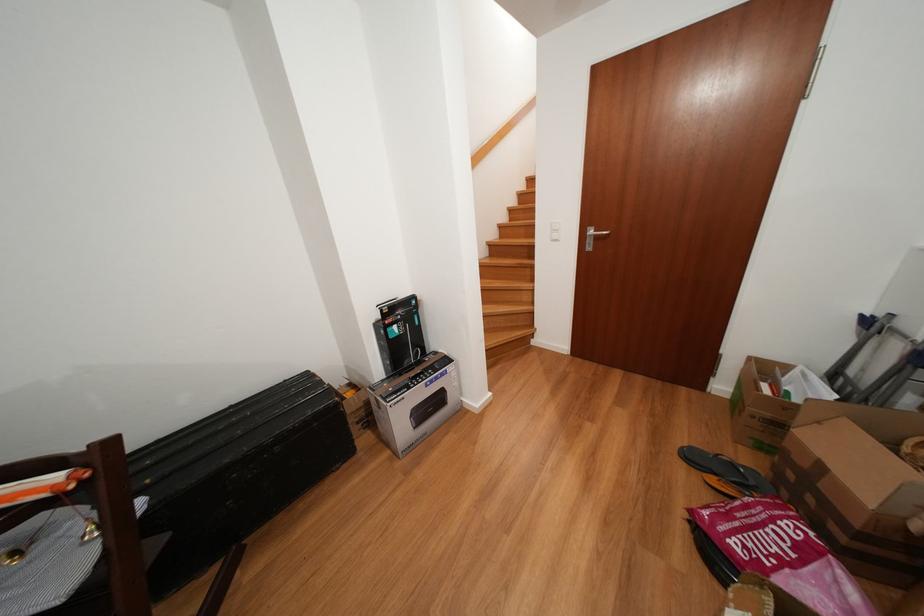
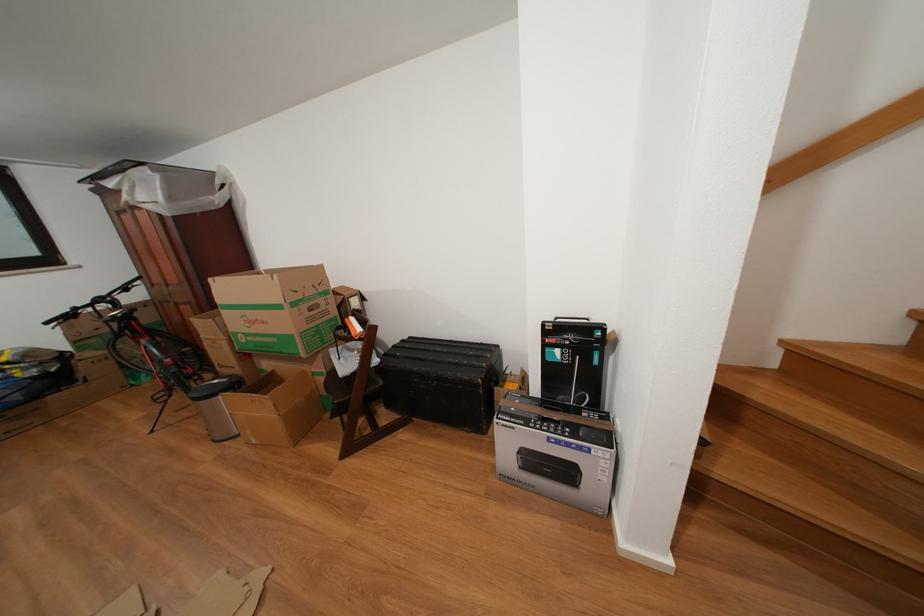
Locate, in the second image, the point that corresponds to (421,302) in the first image.

(611, 333)